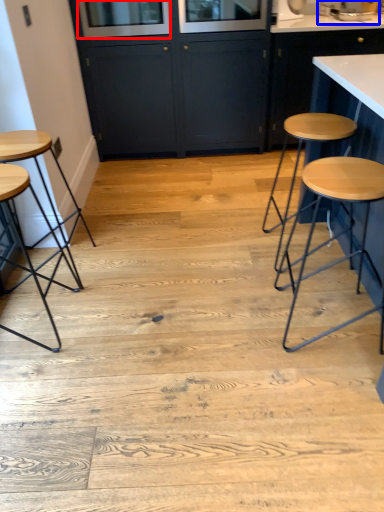
Question: Which of the following is the closest to the observer, window screen (highlighted by a red box) or sink (highlighted by a blue box)?

Choices:
 (A) window screen
 (B) sink

Answer: (A)